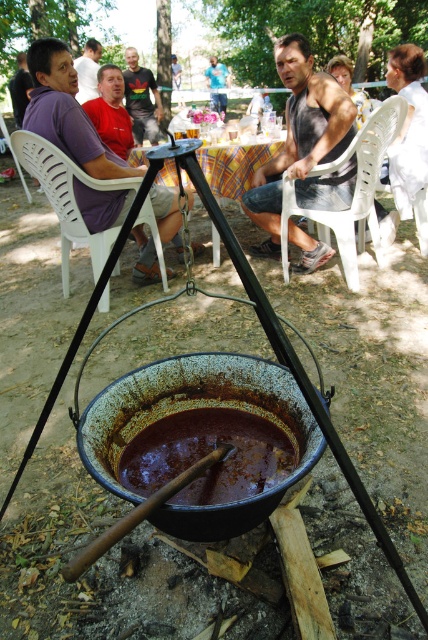
Can you confirm if white plastic chair at left is positioned to the left of matte black t-shirt at center?

In fact, white plastic chair at left is to the right of matte black t-shirt at center.

Can you confirm if white plastic chair at left is positioned to the right of matte black t-shirt at center?

Indeed, white plastic chair at left is positioned on the right side of matte black t-shirt at center.

Who is more forward, (110,237) or (124,81)?

Point (110,237) is in front.

You are a GUI agent. You are given a task and a screenshot of the screen. Output one action in this format:
    pyautogui.click(x=<x>, y=<y>)
    Task: Click on the white plastic chair at left
    
    Given the screenshot: What is the action you would take?
    pyautogui.click(x=68, y=196)

This screenshot has width=428, height=640. What do you see at coordinates (303, 144) in the screenshot?
I see `tank top at center` at bounding box center [303, 144].

Which is below, tank top at center or matte black t-shirt at center?

tank top at center is lower down.

Is point (339, 154) more distant than point (157, 125)?

No, it is in front of (157, 125).

Find the location of `tank top at center`. tank top at center is located at coordinates (303, 144).

Who is more forward, (360, 220) or (243, 189)?

Point (243, 189) is more forward.

From the picture: Which is more to the right, white plastic chair at center or yellow checkered tablecloth at center?

Positioned to the right is white plastic chair at center.

Who is more forward, (336,164) or (208,154)?

Point (336,164) is more forward.

Where is `white plastic chair at center`? Image resolution: width=428 pixels, height=640 pixels. white plastic chair at center is located at coordinates (353, 193).